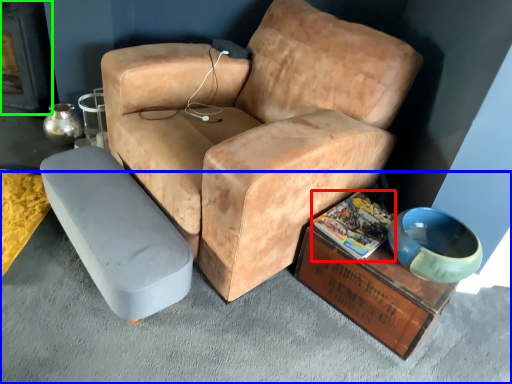
Question: Which object is the farthest from magazine (highlighted by a red box)? Choose among these: concrete (highlighted by a blue box) or fireplace (highlighted by a green box).

Choices:
 (A) concrete
 (B) fireplace

Answer: (B)